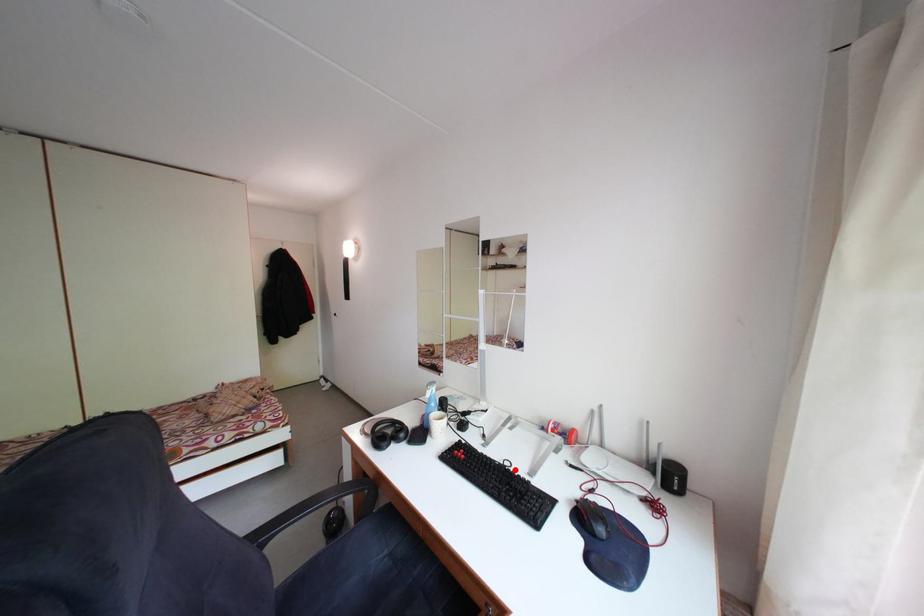
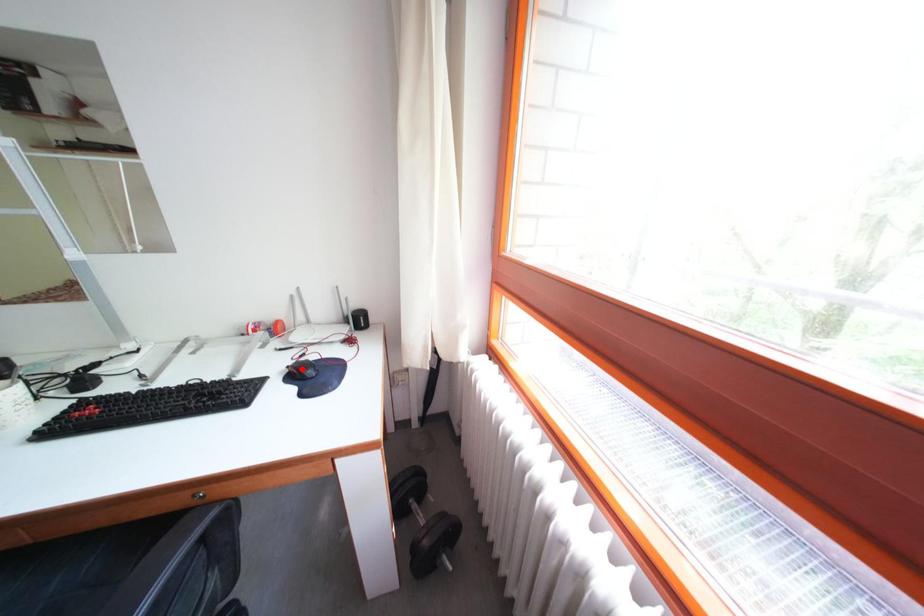
I am providing you with two images of the same scene from different viewpoints. A red point is marked on the first image and another point is marked on the second image. Is the marked point in image1 the same physical position as the marked point in image2?

No